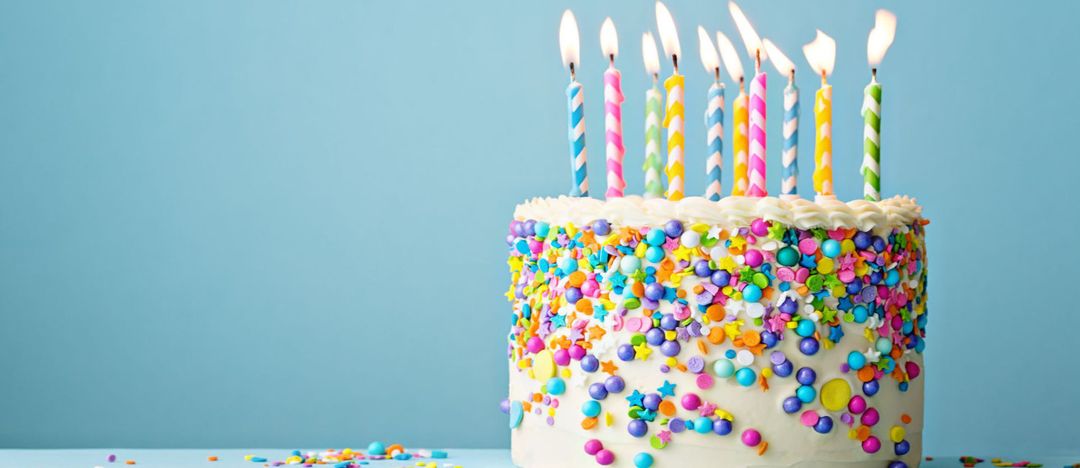
Locate an element on the screen. Image resolution: width=1080 pixels, height=468 pixels. candles is located at coordinates (870, 115), (820, 143), (783, 145), (759, 145), (739, 145), (715, 145), (681, 145), (653, 147), (616, 154), (583, 153).